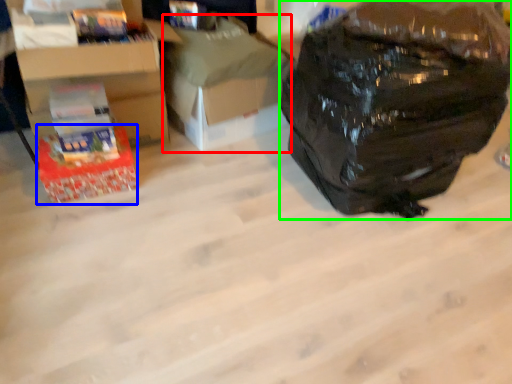
Question: Which is nearer to the cardboard box (highlighted by a red box)? box (highlighted by a blue box) or backpack (highlighted by a green box).

Choices:
 (A) box
 (B) backpack

Answer: (A)